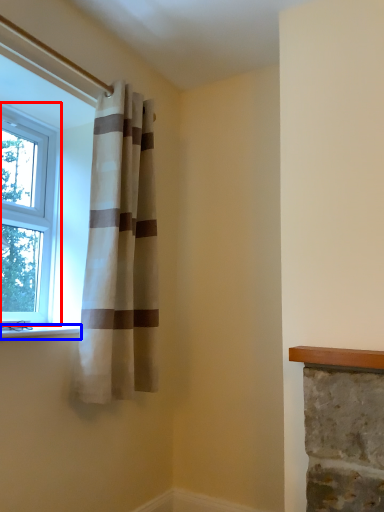
Question: Which object is closer to the camera taking this photo, window (highlighted by a red box) or window sill (highlighted by a blue box)?

Choices:
 (A) window
 (B) window sill

Answer: (B)